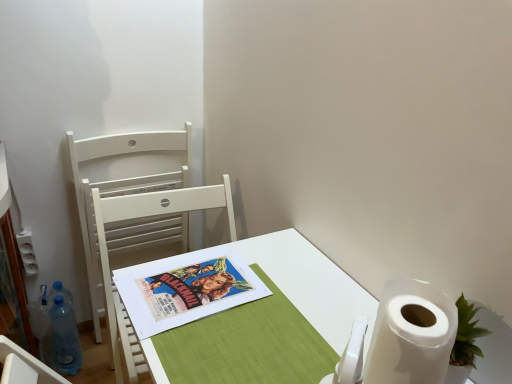
Question: From the image's perspective, relative to white plastic power outlet at left, is white wood chair at left, which is the 1th chair in back-to-front order, above or below?

Choices:
 (A) above
 (B) below

Answer: (A)

Question: Is white wood chair at left, which ranks as the second chair in front-to-back order, in front of or behind white plastic power outlet at left in the image?

Choices:
 (A) behind
 (B) front

Answer: (B)

Question: Which object is positioned farthest from the white wood chair at left, the 2th chair positioned from the back?

Choices:
 (A) colorful paper poster at center
 (B) white wood chair at left, which ranks as the second chair in front-to-back order
 (C) white paper desk at center
 (D) blue translucent bottle at lower left
 (E) white plastic power outlet at left

Answer: (D)

Question: Estimate the real-world distances between objects in this image. Which object is farther from the white paper at lower right?

Choices:
 (A) white wood chair at left, which is the 1th chair in back-to-front order
 (B) colorful paper poster at center
 (C) blue translucent bottle at lower left
 (D) white plastic power outlet at left
 (E) white wood chair at left, the 2th chair positioned from the back

Answer: (D)